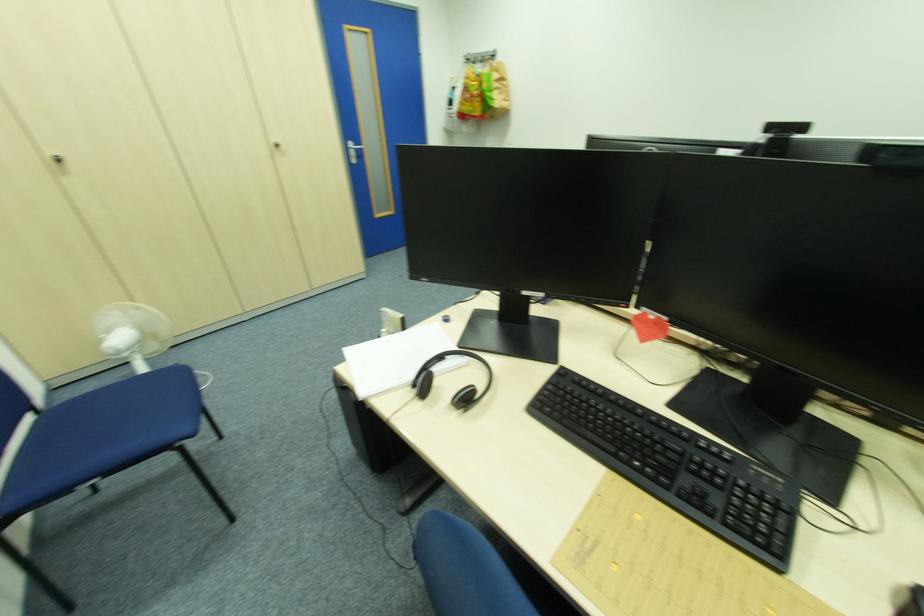
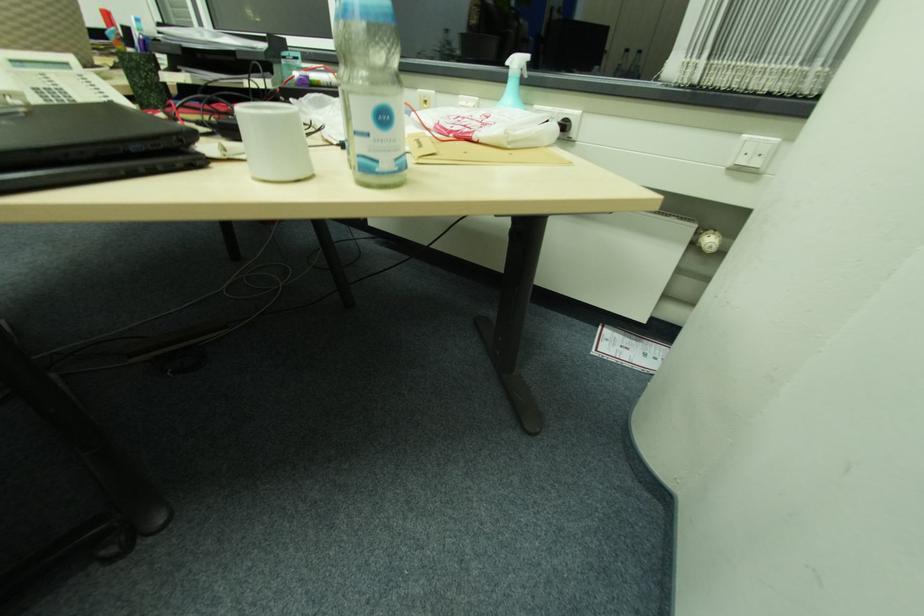
First-person continuous shooting, in which direction is the camera rotating?

The camera's rotation is toward right-down.